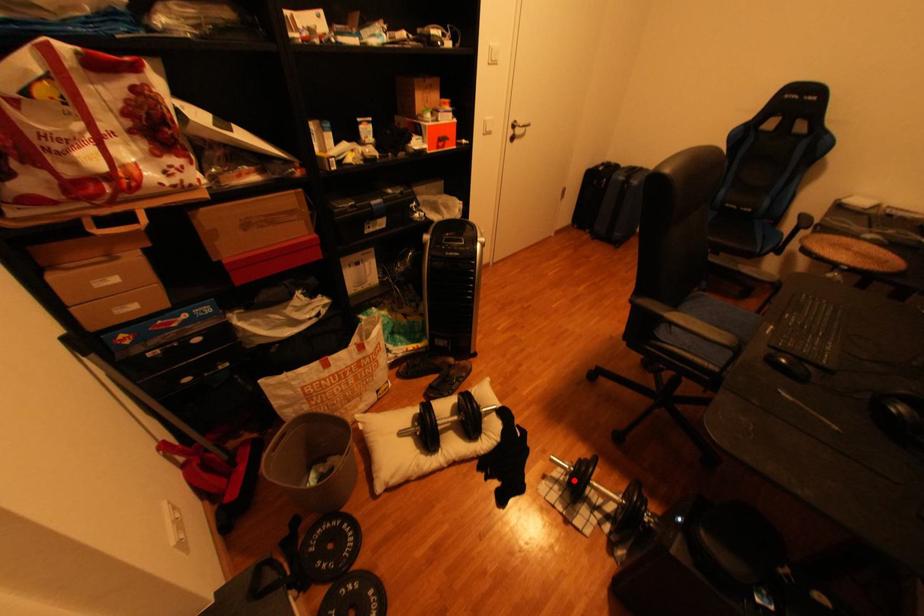
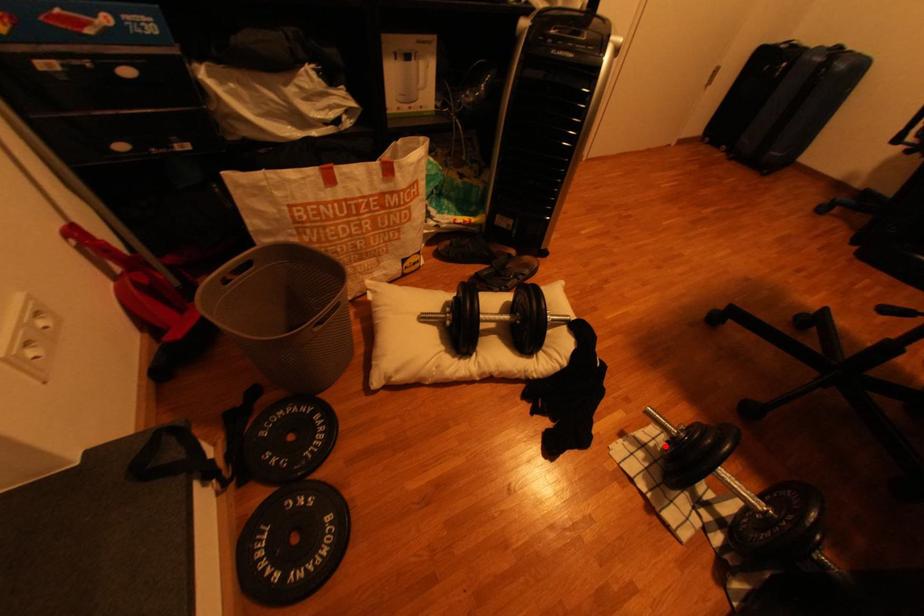
I am providing you with two images of the same scene from different viewpoints. A red point is marked on the first image and another point is marked on the second image. Does the point marked in image1 correspond to the same location as the one in image2?

Yes